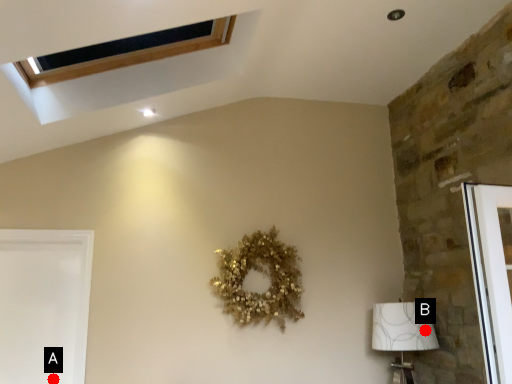
Question: Two points are circled on the image, labeled by A and B beside each circle. Which of the following is the farthest from the observer?

Choices:
 (A) A is further
 (B) B is further

Answer: (A)